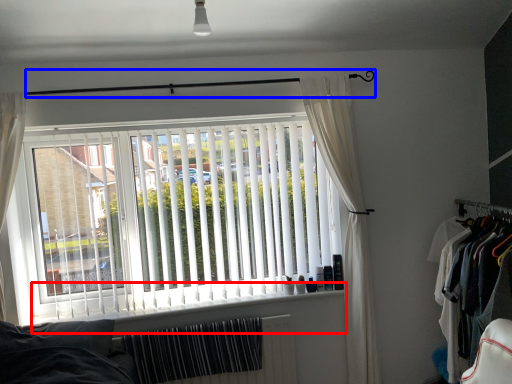
Question: Which of the following is the farthest to the observer, window sill (highlighted by a red box) or clothesline (highlighted by a blue box)?

Choices:
 (A) window sill
 (B) clothesline

Answer: (A)